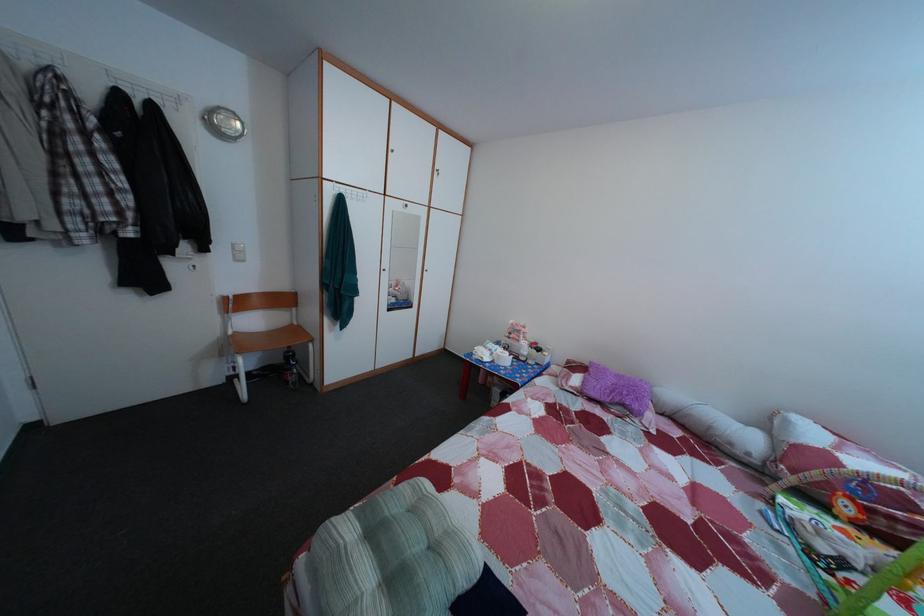
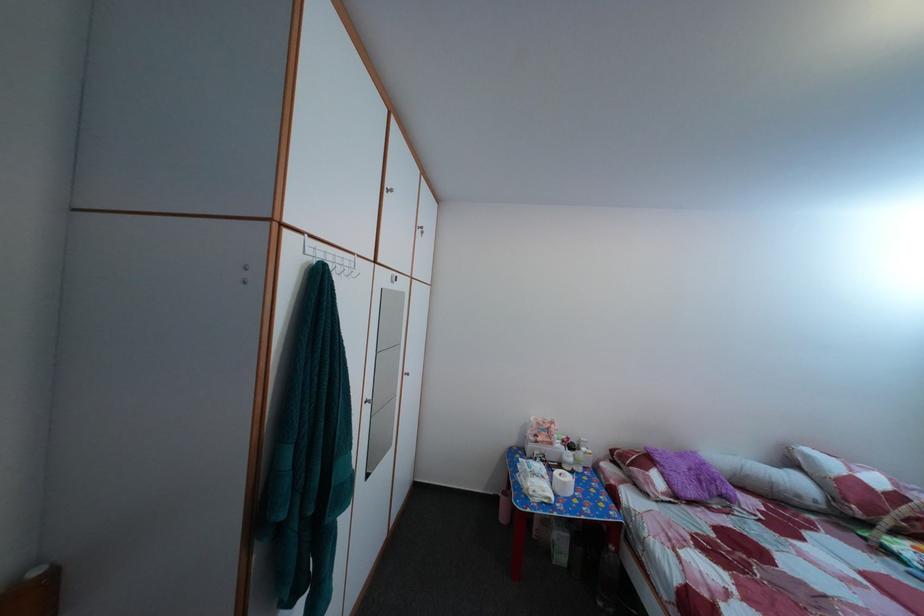
The point at (628, 384) is marked in the first image. Where is the corresponding point in the second image?

(689, 464)